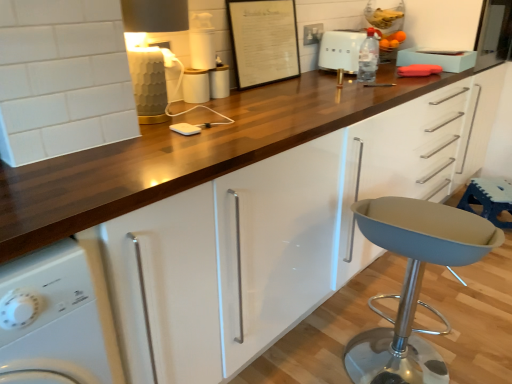
Identify the location of free spot to the right of matte gray stool at lower right. Image resolution: width=512 pixels, height=384 pixels. (473, 339).